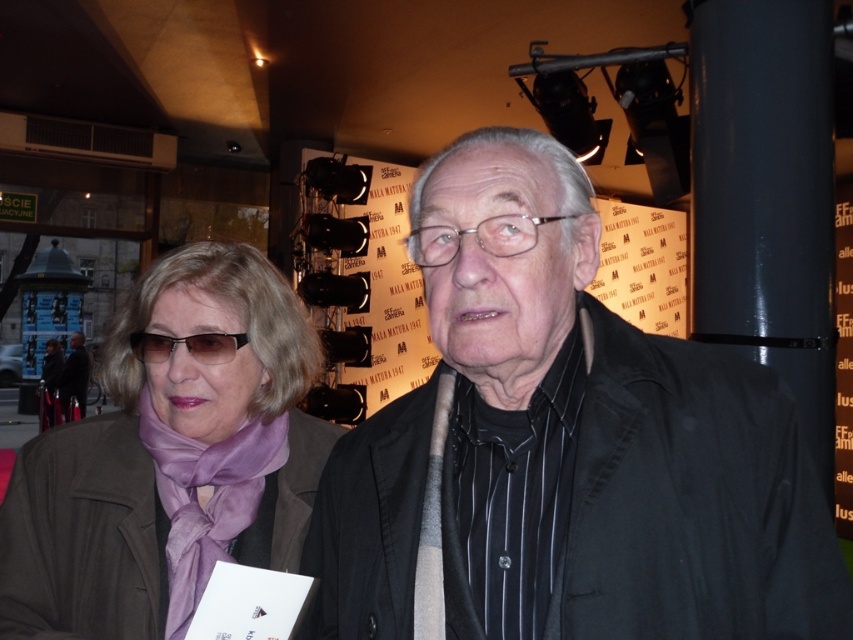
You are designing a display case for a boutique store. The case has a shelf that can only accommodate items up to 12 inches wide. You need to place both the matte purple scarf at center and the matte black glasses at center on the shelf. Based on their sizes, will both items fit on the shelf together?

The matte purple scarf at center is wider than the matte black glasses at center. Since the shelf can only hold items up to 12 inches wide, and the scarf is wider than the glasses, it depends on the combined width of both items. However, the description only provides a comparison between their widths, not exact measurements. Without knowing the exact width of either item, we cannot determine if they will fit together on the 12 inch shelf.

You are a photographer at an event and need to arrange two people for a photo. The scene has a black matte jacket at center and a matte black jacket at center. Which jacket should be placed to the left to match the original image?

The matte black jacket at center should be placed to the left because the black matte jacket at center is positioned on the right side of it in the original image.

You are standing in front of the scene and want to hand a gift to the person wearing the matte purple scarf at center. Which direction should you move to reach them?

The matte purple scarf at center is located at point (169, 460), so you should move towards the center of the scene to reach the person wearing the matte purple scarf at center.